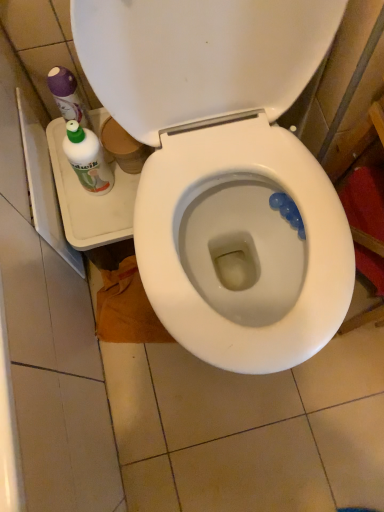
This screenshot has height=512, width=384. Identify the location of white glossy bottle at left. (87, 159).

Image resolution: width=384 pixels, height=512 pixels. What do you see at coordinates (87, 159) in the screenshot?
I see `white glossy bottle at left` at bounding box center [87, 159].

Find the location of a particular element. This screenshot has height=512, width=384. white glossy bottle at left is located at coordinates (87, 159).